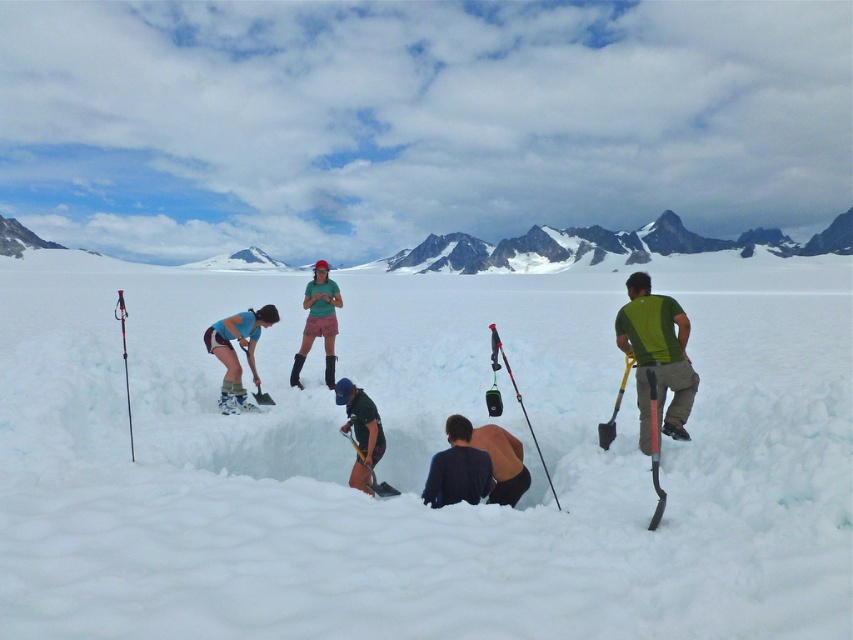
Looking at this image, can you confirm if white fluffy snow at center is positioned below matte blue shorts at center?

No.

Is point (109, 609) positioned after point (222, 323)?

No, (109, 609) is closer to viewer.

Locate an element on the screen. The image size is (853, 640). white fluffy snow at center is located at coordinates coord(421,458).

Who is more distant from viewer, [140,621] or [312,308]?

The point [312,308] is behind.

Is white fluffy snow at center closer to the viewer compared to green fabric shorts at center?

Yes, white fluffy snow at center is closer to the viewer.

Is point (0, 499) closer to camera compared to point (322, 276)?

Yes, it is.

You are a GUI agent. You are given a task and a screenshot of the screen. Output one action in this format:
    pyautogui.click(x=<x>, y=<y>)
    Task: Click on the white fluffy snow at center
    The image size is (853, 640).
    Given the screenshot: What is the action you would take?
    pyautogui.click(x=421, y=458)

Does point (459, 429) lie behind point (352, 429)?

No, it is not.

Who is positioned more to the right, dark blue fabric at center or dark green fabric jacket at center?

From the viewer's perspective, dark blue fabric at center appears more on the right side.

Is point (466, 440) positioned behind point (364, 406)?

No, (466, 440) is in front of (364, 406).

Where is `dark blue fabric at center`? This screenshot has width=853, height=640. dark blue fabric at center is located at coordinates (457, 468).